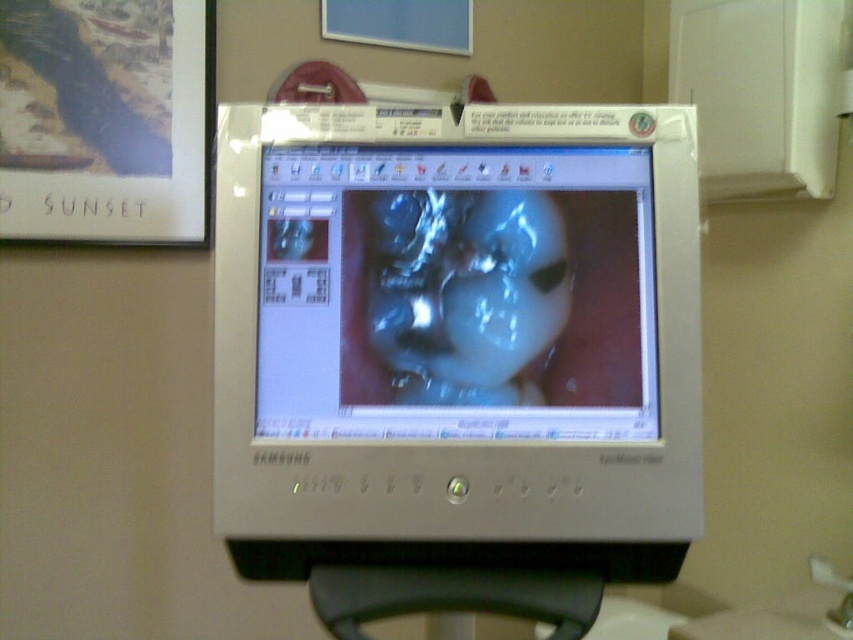
Question: Estimate the real-world distances between objects in this image. Which object is closer to the silver metallic monitor at center?

Choices:
 (A) translucent plastic face at center
 (B) shiny metallic monitor at center

Answer: (B)

Question: Is silver metallic monitor at center below shiny metallic monitor at center?

Choices:
 (A) no
 (B) yes

Answer: (B)

Question: Based on their relative distances, which object is farther from the silver metallic monitor at center?

Choices:
 (A) translucent plastic face at center
 (B) shiny metallic monitor at center

Answer: (A)

Question: Does shiny metallic monitor at center have a smaller size compared to translucent plastic face at center?

Choices:
 (A) yes
 (B) no

Answer: (B)

Question: Which object is the closest to the translucent plastic face at center?

Choices:
 (A) silver metallic monitor at center
 (B) shiny metallic monitor at center

Answer: (B)

Question: Is silver metallic monitor at center in front of shiny metallic monitor at center?

Choices:
 (A) yes
 (B) no

Answer: (A)